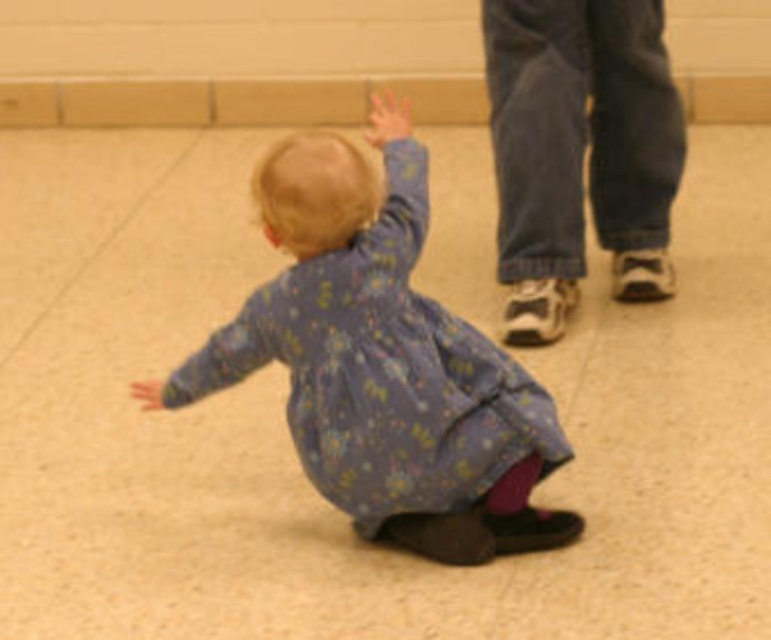
Question: Which point appears closest to the camera in this image?

Choices:
 (A) (147, 394)
 (B) (583, 26)
 (C) (386, 362)

Answer: (C)

Question: Among these objects, which one is nearest to the camera?

Choices:
 (A) smooth skin hand at center
 (B) matte skin hand at lower left
 (C) floral-patterned dress at center

Answer: (C)

Question: Is denim pants at right smaller than matte skin hand at lower left?

Choices:
 (A) no
 (B) yes

Answer: (A)

Question: Which of the following is the farthest from the observer?

Choices:
 (A) matte skin hand at lower left
 (B) floral-patterned dress at center
 (C) smooth skin hand at center
 (D) denim pants at right

Answer: (D)

Question: Does floral-patterned dress at center appear on the right side of smooth skin hand at center?

Choices:
 (A) no
 (B) yes

Answer: (A)

Question: Can you confirm if denim pants at right is smaller than matte skin hand at lower left?

Choices:
 (A) yes
 (B) no

Answer: (B)